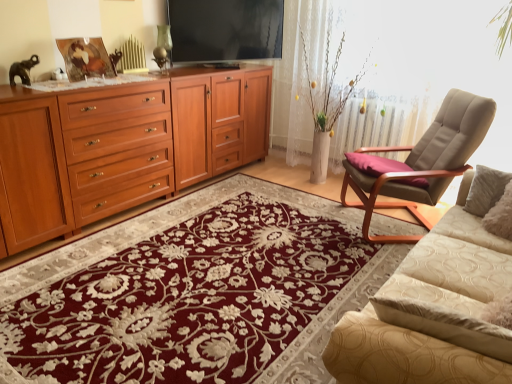
Describe the element at coordinates (375, 164) in the screenshot. The image size is (512, 384). I see `purple fabric pillow at right` at that location.

In order to click on beige fabric chair at right in this screenshot , I will do `click(420, 162)`.

What is the approximate width of metallic gold picture frame at upper left?

7.83 inches.

The image size is (512, 384). I want to click on floral carpet at center, so 194,292.

This screenshot has width=512, height=384. What are the coordinates of `purple fabric pillow at right` in the screenshot? It's located at [x=375, y=164].

Is beige fabric chair at right in contact with matte wood drawer at left?

beige fabric chair at right and matte wood drawer at left are not in contact.

From the image's perspective, is beige fabric chair at right under matte wood drawer at left?

Yes, from the image's perspective, beige fabric chair at right is beneath matte wood drawer at left.

Measure the distance between beige fabric chair at right and matte wood drawer at left.

beige fabric chair at right is 1.74 meters away from matte wood drawer at left.

From a real-world perspective, is beige fabric chair at right physically located above or below matte wood drawer at left?

Clearly, from a real-world perspective, beige fabric chair at right is below matte wood drawer at left.

Would you say beige fabric chair at right is inside or outside purple fabric pillow at right?

beige fabric chair at right cannot be found inside purple fabric pillow at right.

Relative to purple fabric pillow at right, is beige fabric chair at right in front or behind?

beige fabric chair at right is positioned closer to the viewer than purple fabric pillow at right.

Does beige fabric chair at right turn towards purple fabric pillow at right?

Yes, beige fabric chair at right faces towards purple fabric pillow at right.

Can you confirm if beige fabric chair at right is shorter than purple fabric pillow at right?

No.

From a real-world perspective, is matte wood drawer at left positioned over metallic gold picture frame at upper left based on gravity?

Actually, matte wood drawer at left is physically below metallic gold picture frame at upper left in the real world.

At what (x,y) coordinates should I click in order to perform the action: click on picture frame that appears behind the matte wood drawer at left. Please return your answer as a coordinate pair (x, y). This screenshot has height=384, width=512. Looking at the image, I should click on (85, 58).

Considering the sizes of objects matte wood drawer at left and metallic gold picture frame at upper left in the image provided, who is shorter, matte wood drawer at left or metallic gold picture frame at upper left?

Standing shorter between the two is metallic gold picture frame at upper left.

From the image's perspective, is beige textured couch at lower right located beneath matte wood drawer at left?

Indeed, from the image's perspective, beige textured couch at lower right is shown beneath matte wood drawer at left.

You are a GUI agent. You are given a task and a screenshot of the screen. Output one action in this format:
    pyautogui.click(x=<x>, y=<y>)
    Task: Click on the studio couch that is on the right side of matte wood drawer at left
    Image resolution: width=512 pixels, height=384 pixels.
    Given the screenshot: What is the action you would take?
    pyautogui.click(x=429, y=311)

Based on the photo, from a real-world perspective, relative to matte wood drawer at left, is beige textured couch at lower right vertically above or below?

In terms of real-world spatial position, beige textured couch at lower right is above matte wood drawer at left.

Is beige textured couch at lower right shorter than matte wood drawer at left?

Indeed, beige textured couch at lower right has a lesser height compared to matte wood drawer at left.

Considering the relative sizes of beige fabric chair at right and matte wood cabinet at left in the image provided, is beige fabric chair at right bigger than matte wood cabinet at left?

No, beige fabric chair at right is not bigger than matte wood cabinet at left.

From the image's perspective, does beige fabric chair at right appear lower than matte wood cabinet at left?

Yes.

Can you confirm if beige fabric chair at right is thinner than matte wood cabinet at left?

No, beige fabric chair at right is not thinner than matte wood cabinet at left.

Who is more distant, beige fabric chair at right or matte wood cabinet at left?

matte wood cabinet at left is behind.

Is matte wood drawer at left smaller than beige fabric chair at right?

Correct, matte wood drawer at left occupies less space than beige fabric chair at right.

Which point is more forward, (150, 186) or (453, 162)?

The point (453, 162) is more forward.

Does matte wood drawer at left turn towards beige fabric chair at right?

No, matte wood drawer at left is not aimed at beige fabric chair at right.

I want to click on chair that appears above the beige textured couch at lower right (from the image's perspective), so click(420, 162).

Could you tell me if beige textured couch at lower right is turned towards beige fabric chair at right?

Yes, beige textured couch at lower right is facing beige fabric chair at right.

Does point (402, 317) come behind point (463, 121)?

That is False.

Considering the sizes of objects beige textured couch at lower right and beige fabric chair at right in the image provided, who is thinner, beige textured couch at lower right or beige fabric chair at right?

With smaller width is beige textured couch at lower right.

Find the location of `chair below the matte wood drawer at left (from the image's perspective)`. chair below the matte wood drawer at left (from the image's perspective) is located at coordinates (420, 162).

Locate an element on the screen. The width and height of the screenshot is (512, 384). pillow located on the left of beige fabric chair at right is located at coordinates (375, 164).

Looking at the image, which one is located closer to purple fabric pillow at right, flat screen tv at upper center or matte wood cabinet at left?

matte wood cabinet at left is positioned closer to the anchor purple fabric pillow at right.

When comparing their distances from beige textured couch at lower right, does matte wood cabinet at left or floral carpet at center seem further?

matte wood cabinet at left.

From the image, which object appears to be farther from metallic gold picture frame at upper left, matte wood drawer at left or matte wood cabinet at left?

matte wood cabinet at left lies further to metallic gold picture frame at upper left than the other object.

Looking at the image, which one is located further to purple fabric pillow at right, flat screen tv at upper center or beige fabric chair at right?

Among the two, flat screen tv at upper center is located further to purple fabric pillow at right.

Looking at the image, which one is located further to purple fabric pillow at right, beige fabric chair at right or beige textured couch at lower right?

Among the two, beige textured couch at lower right is located further to purple fabric pillow at right.

When comparing their distances from floral carpet at center, does purple fabric pillow at right or beige textured couch at lower right seem further?

Among the two, purple fabric pillow at right is located further to floral carpet at center.

From the image, which object appears to be farther from matte wood drawer at left, floral carpet at center or beige fabric chair at right?

beige fabric chair at right lies further to matte wood drawer at left than the other object.

When comparing their distances from metallic gold picture frame at upper left, does purple fabric pillow at right or beige fabric chair at right seem further?

The object further to metallic gold picture frame at upper left is beige fabric chair at right.

You are a GUI agent. You are given a task and a screenshot of the screen. Output one action in this format:
    pyautogui.click(x=<x>, y=<y>)
    Task: Click on the pillow between floral carpet at center and matte wood cabinet at left in the front-back direction
    
    Given the screenshot: What is the action you would take?
    pyautogui.click(x=375, y=164)

In order to click on picture frame positioned between beige textured couch at lower right and matte wood cabinet at left from near to far in this screenshot , I will do `click(85, 58)`.

The width and height of the screenshot is (512, 384). What are the coordinates of `tv cabinet positioned between floral carpet at center and flat screen tv at upper center from near to far` in the screenshot? It's located at (219, 122).

The image size is (512, 384). I want to click on studio couch between matte wood drawer at left and purple fabric pillow at right, so click(x=429, y=311).